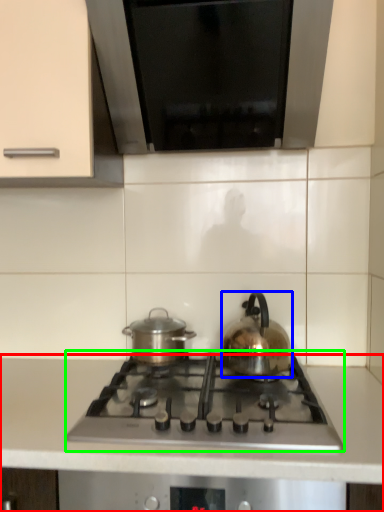
Question: Which object is positioned farthest from countertop (highlighted by a red box)? Select from kettle (highlighted by a blue box) and gas stove (highlighted by a green box).

Choices:
 (A) kettle
 (B) gas stove

Answer: (A)